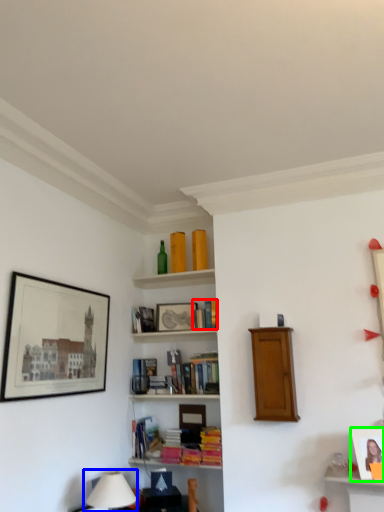
Question: Which object is the farthest from book (highlighted by a red box)? Choose among these: table lamp (highlighted by a blue box) or picture frame (highlighted by a green box).

Choices:
 (A) table lamp
 (B) picture frame

Answer: (A)